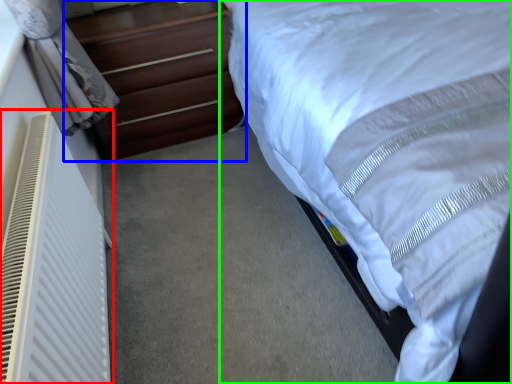
Question: Considering the real-world distances, which object is farthest from air conditioner (highlighted by a red box)? chest of drawers (highlighted by a blue box) or bed (highlighted by a green box)?

Choices:
 (A) chest of drawers
 (B) bed

Answer: (A)